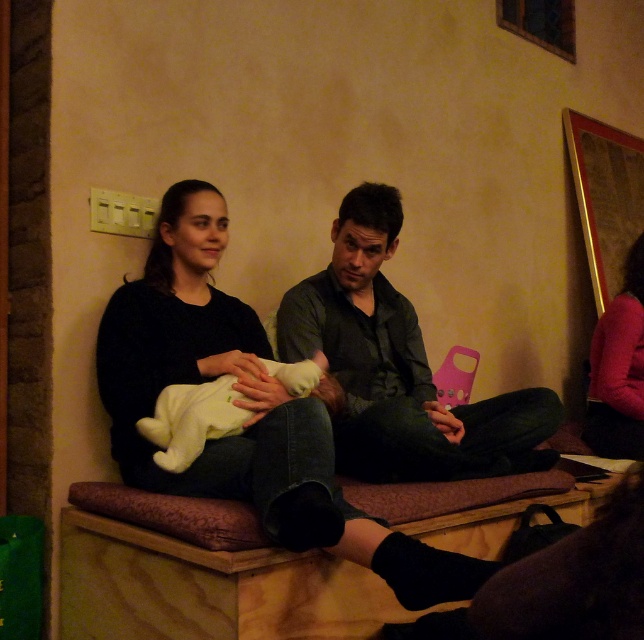
Question: Observing the image, what is the correct spatial positioning of matte pink sweater at right in reference to white soft baby at center?

Choices:
 (A) left
 (B) right

Answer: (B)

Question: In this image, where is dark gray shirt at center located relative to matte pink sweater at right?

Choices:
 (A) above
 (B) below

Answer: (A)

Question: Can you confirm if dark gray shirt at center is thinner than matte pink sweater at right?

Choices:
 (A) no
 (B) yes

Answer: (A)

Question: Which of the following is the farthest from the observer?

Choices:
 (A) matte pink sweater at right
 (B) dark gray shirt at center

Answer: (A)

Question: Which of these objects is positioned farthest from the matte pink sweater at right?

Choices:
 (A) black matte sweater at center
 (B) dark gray shirt at center
 (C) white soft baby at center

Answer: (C)

Question: Which object appears closest to the camera in this image?

Choices:
 (A) dark gray shirt at center
 (B) black matte sweater at center

Answer: (B)